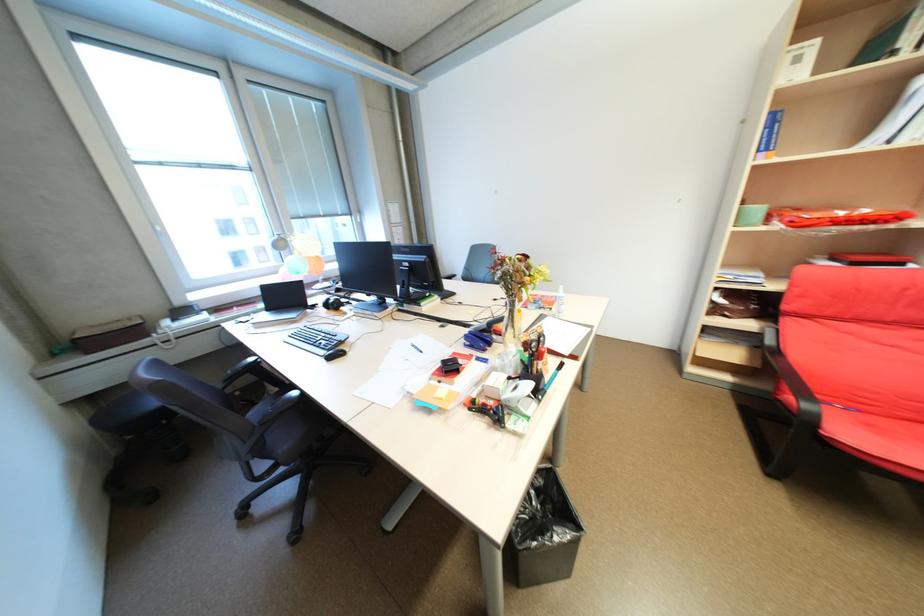
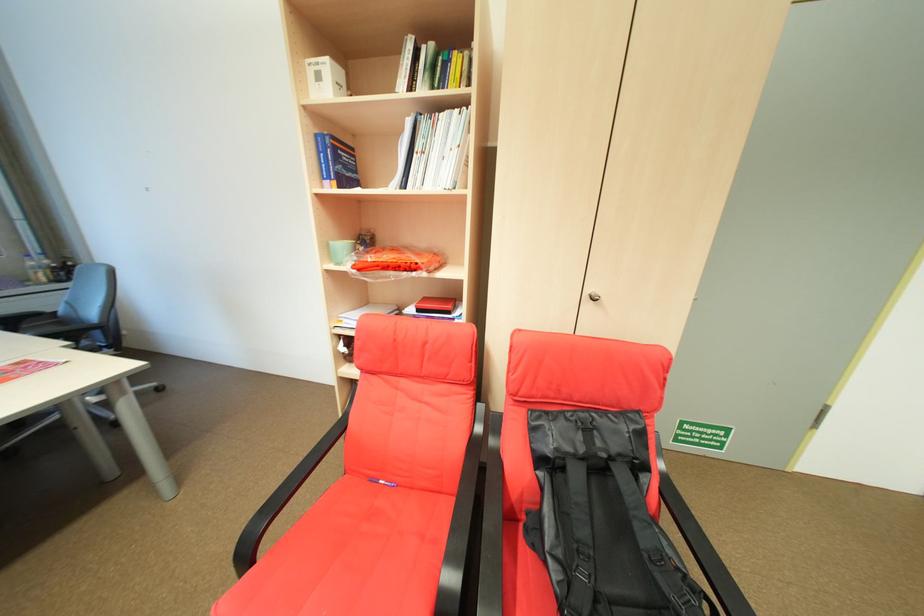
Question: What movement of the cameraman would produce the second image?

Choices:
 (A) Left
 (B) Right
 (C) Forward
 (D) Backward

Answer: (B)